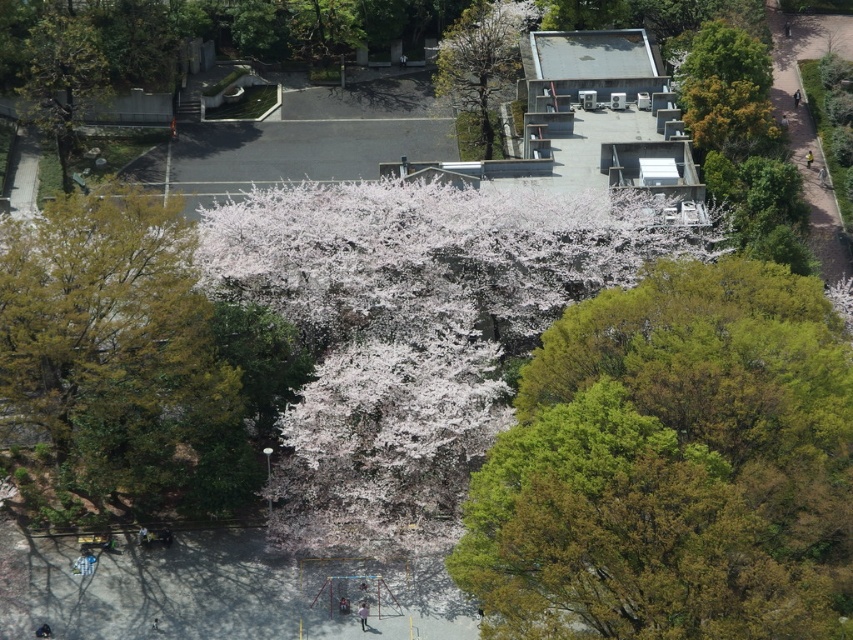
You are planning to plant a new tree in the park and need to know the relative sizes of the existing trees. Based on the image, which object is bigger between the white blossoms at center and the smooth bark tree at upper center?

The white blossoms at center has a larger size compared to the smooth bark tree at upper center, so the white blossoms at center is bigger.

Based on the scene described, which green leafy tree has a greater width between the green leafy tree at center and the green leafy tree at lower left?

The green leafy tree at center has a greater width compared to the green leafy tree at lower left as stated in the description.

You are standing at the point marked as point (672, 467) in the park. What type of tree are you currently under?

The point (672, 467) is on a green leafy tree at center, so you are under a green leafy tree at center.